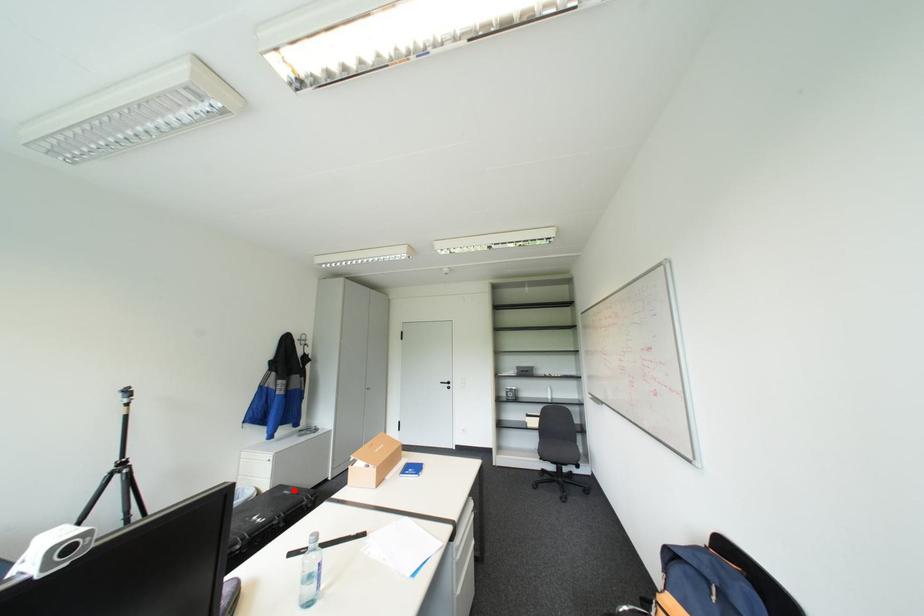
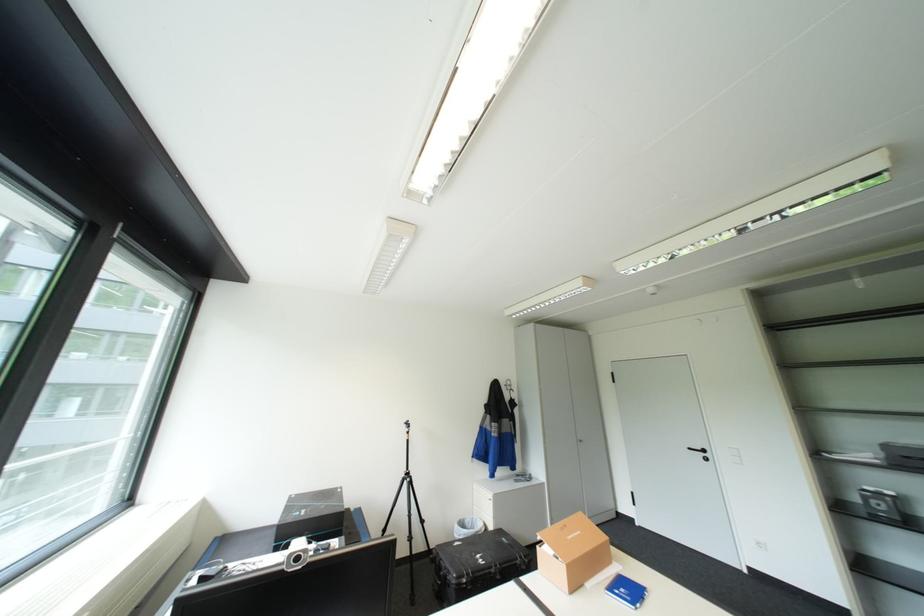
Question: I am providing you with two images of the same scene from different viewpoints. Image1 has a red point marked. In image2, the corresponding 3D location appears at what relative position? Reply with the corresponding letter.

Choices:
 (A) Closer
 (B) Farther

Answer: (B)